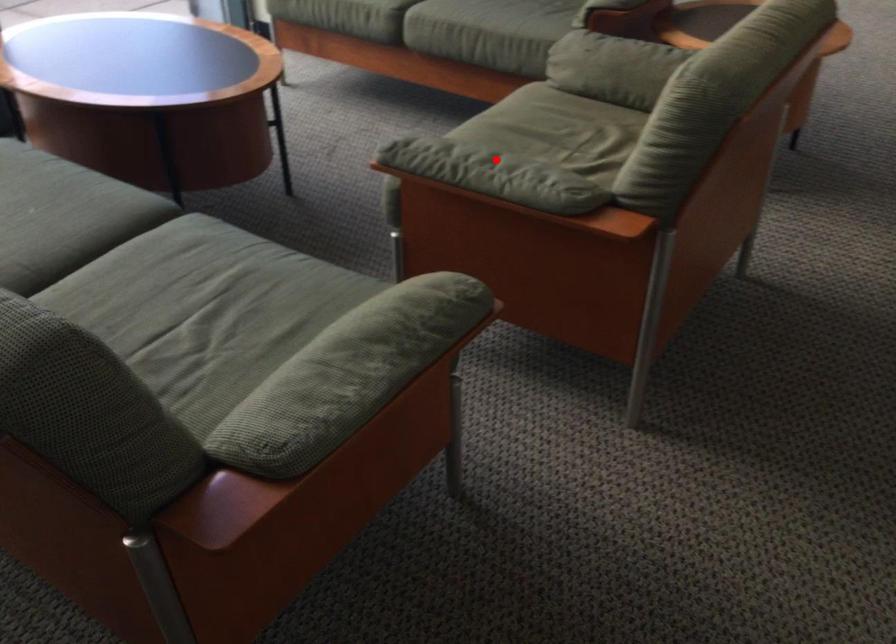
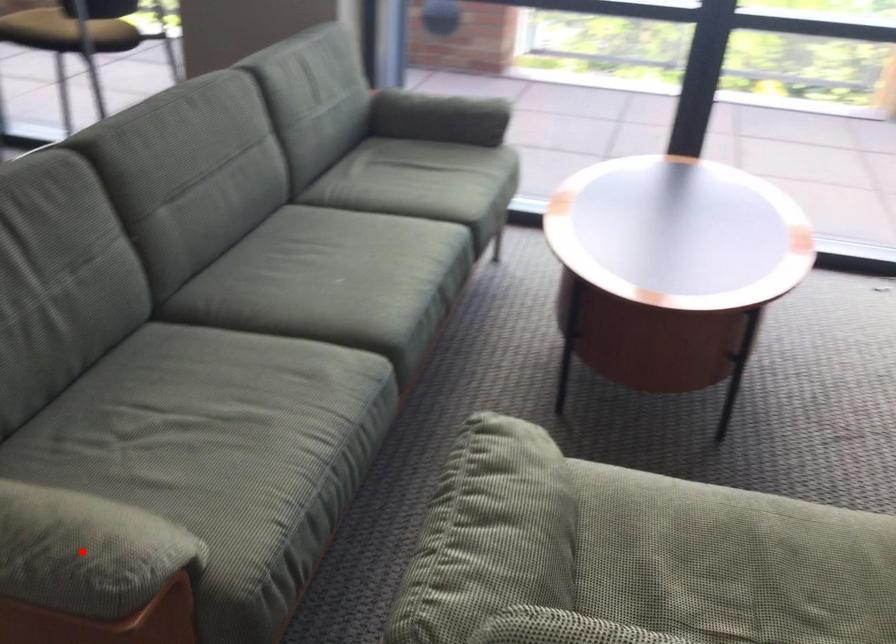
I am providing you with two images of the same scene from different viewpoints. A red point is marked on the first image and another point is marked on the second image. Is the marked point in image1 the same physical position as the marked point in image2?

No